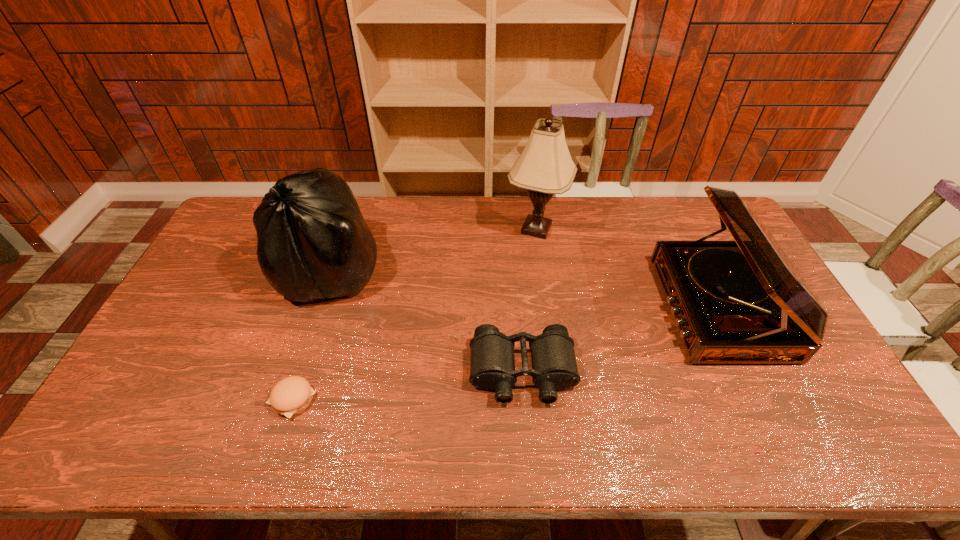
Locate an element on the screen. This screenshot has width=960, height=540. free space located on the front-facing side of the rightmost object is located at coordinates (543, 308).

Where is `free space located 0.120m through the eyepieces of the binoculars`? The image size is (960, 540). free space located 0.120m through the eyepieces of the binoculars is located at coordinates (529, 456).

The image size is (960, 540). I want to click on vacant area situated on the left of the shortest object, so click(156, 400).

The image size is (960, 540). Find the location of `lamp at the far edge`. lamp at the far edge is located at coordinates (545, 167).

Where is `plastic bag located in the far edge section of the desktop`? Image resolution: width=960 pixels, height=540 pixels. plastic bag located in the far edge section of the desktop is located at coordinates (313, 243).

Where is `object present at the near edge`? The image size is (960, 540). object present at the near edge is located at coordinates (290, 396).

Image resolution: width=960 pixels, height=540 pixels. Find the location of `object located in the right edge section of the desktop`. object located in the right edge section of the desktop is located at coordinates (735, 302).

The height and width of the screenshot is (540, 960). Find the location of `vacant point at the far edge`. vacant point at the far edge is located at coordinates (595, 204).

This screenshot has width=960, height=540. I want to click on blank space at the near edge of the desktop, so click(159, 449).

This screenshot has height=540, width=960. What are the coordinates of `vacant space at the left edge of the desktop` in the screenshot? It's located at (217, 283).